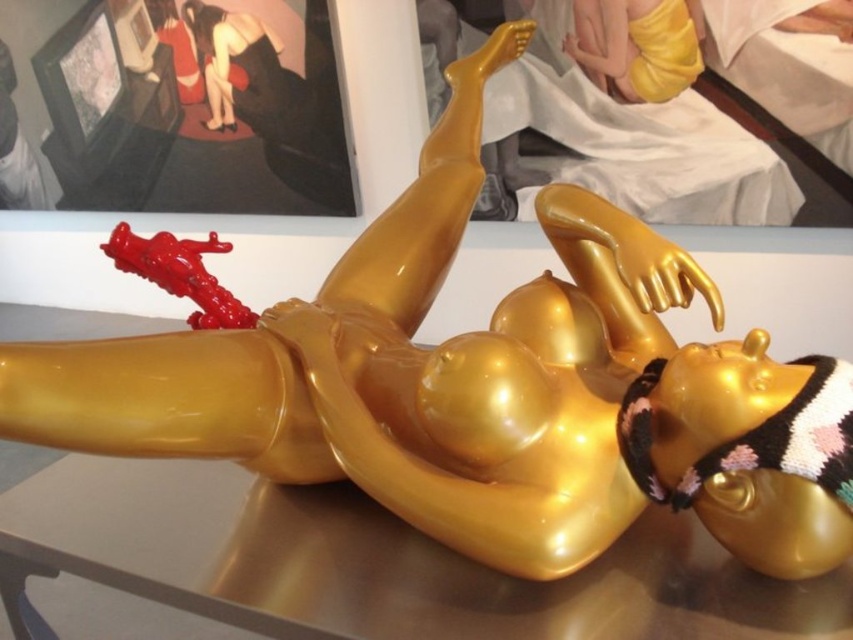
Describe the element at coordinates (381, 563) in the screenshot. I see `transparent glass table at lower center` at that location.

The width and height of the screenshot is (853, 640). What do you see at coordinates (381, 563) in the screenshot?
I see `transparent glass table at lower center` at bounding box center [381, 563].

The height and width of the screenshot is (640, 853). What are the coordinates of `transparent glass table at lower center` in the screenshot? It's located at (381, 563).